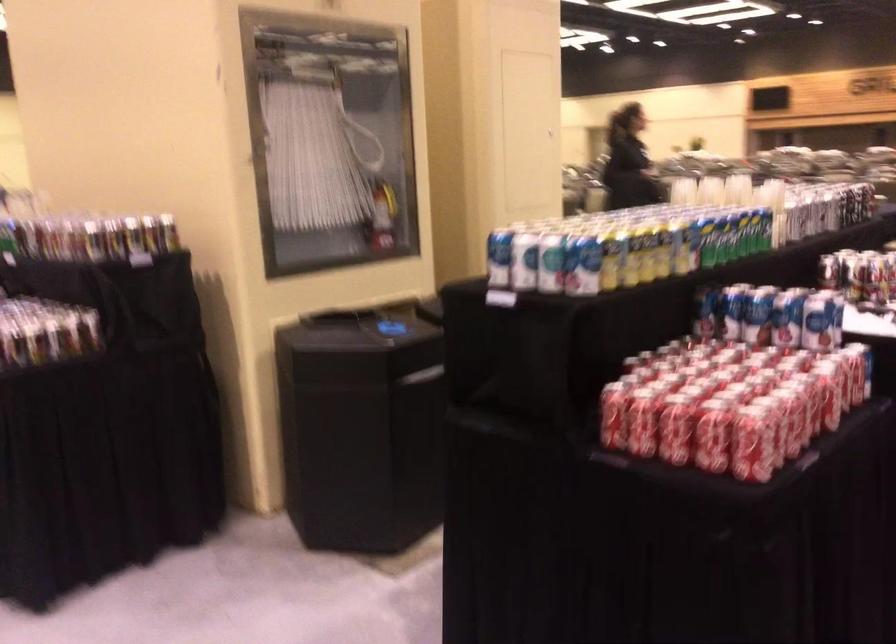
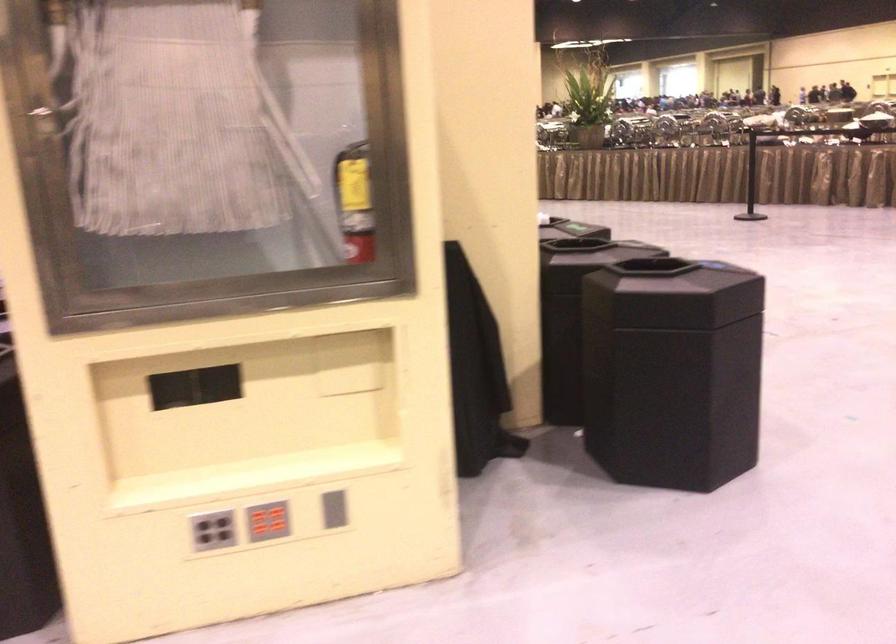
Question: I am providing you with two images of the same scene from different viewpoints. Which of the following objects are not visible in image2?

Choices:
 (A) black backpack handle
 (B) fire hose nozzle
 (C) black trash can lid
 (D) red button panel

Answer: (B)